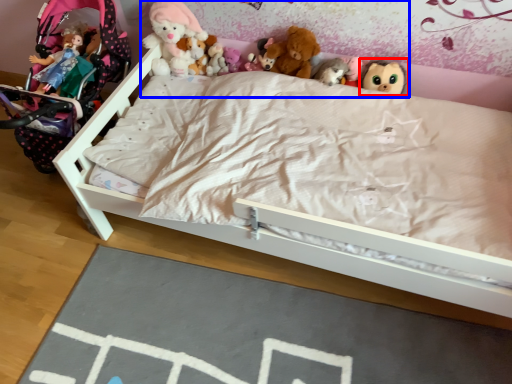
Question: Which object is closer to the camera taking this photo, toy (highlighted by a red box) or collection (highlighted by a blue box)?

Choices:
 (A) toy
 (B) collection

Answer: (B)